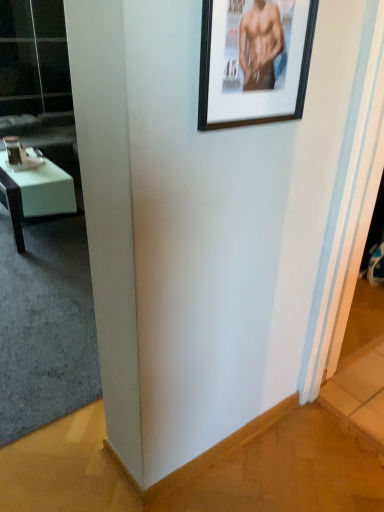
Question: From the image's perspective, is transparent glass door at upper left below white glossy desk at left?

Choices:
 (A) yes
 (B) no

Answer: (B)

Question: Is transparent glass door at upper left turned away from white glossy desk at left?

Choices:
 (A) no
 (B) yes

Answer: (A)

Question: Is white glossy desk at left completely or partially inside transparent glass door at upper left?

Choices:
 (A) no
 (B) yes

Answer: (A)

Question: Is transparent glass door at upper left directly adjacent to white glossy desk at left?

Choices:
 (A) no
 (B) yes

Answer: (A)

Question: From a real-world perspective, is transparent glass door at upper left physically above white glossy desk at left?

Choices:
 (A) yes
 (B) no

Answer: (A)

Question: In terms of size, does white glossy desk at left appear bigger or smaller than transparent glass door at upper left?

Choices:
 (A) small
 (B) big

Answer: (A)

Question: From the image's perspective, is white glossy desk at left positioned above or below transparent glass door at upper left?

Choices:
 (A) below
 (B) above

Answer: (A)

Question: In the image, is white glossy desk at left positioned in front of or behind transparent glass door at upper left?

Choices:
 (A) behind
 (B) front

Answer: (B)

Question: Is white glossy desk at left inside the boundaries of transparent glass door at upper left, or outside?

Choices:
 (A) outside
 (B) inside

Answer: (A)

Question: Considering the relative positions of white leather couch at left and white glossy desk at left in the image provided, is white leather couch at left to the left or to the right of white glossy desk at left?

Choices:
 (A) right
 (B) left

Answer: (B)

Question: Relative to white glossy desk at left, is white leather couch at left in front or behind?

Choices:
 (A) behind
 (B) front

Answer: (A)

Question: Based on their sizes in the image, would you say white leather couch at left is bigger or smaller than white glossy desk at left?

Choices:
 (A) big
 (B) small

Answer: (A)

Question: From a real-world perspective, is white leather couch at left physically located above or below white glossy desk at left?

Choices:
 (A) above
 (B) below

Answer: (A)

Question: In the image, is transparent glass door at upper left on the left side or the right side of black matte picture frame at upper right?

Choices:
 (A) right
 (B) left

Answer: (B)

Question: In terms of width, does transparent glass door at upper left look wider or thinner when compared to black matte picture frame at upper right?

Choices:
 (A) wide
 (B) thin

Answer: (A)